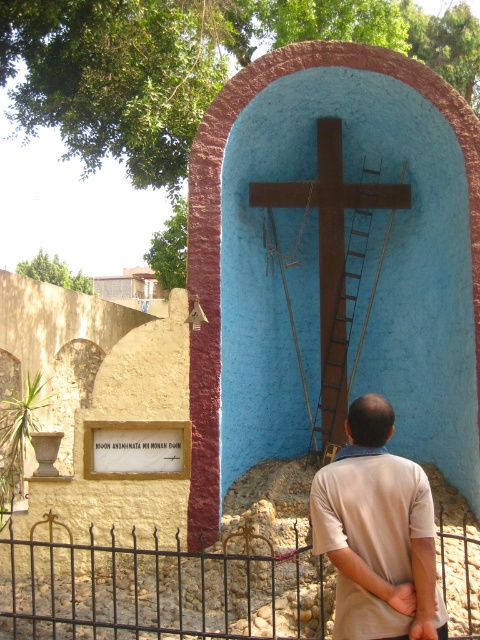
Question: Where is beige cotton shirt at center located in relation to wooden ladder at center in the image?

Choices:
 (A) above
 (B) below

Answer: (B)

Question: Which object is positioned closest to the black wrought iron fence at lower center?

Choices:
 (A) beige cotton shirt at center
 (B) brown wooden cross at center
 (C) wooden ladder at center

Answer: (A)

Question: In this image, where is black wrought iron fence at lower center located relative to brown wooden cross at center?

Choices:
 (A) right
 (B) left

Answer: (B)

Question: Which object is positioned farthest from the brown wooden cross at center?

Choices:
 (A) beige cotton shirt at center
 (B) wooden ladder at center
 (C) black wrought iron fence at lower center

Answer: (A)

Question: Estimate the real-world distances between objects in this image. Which object is farther from the black wrought iron fence at lower center?

Choices:
 (A) beige cotton shirt at center
 (B) wooden ladder at center

Answer: (B)

Question: Is black wrought iron fence at lower center thinner than brown wooden cross at center?

Choices:
 (A) no
 (B) yes

Answer: (A)